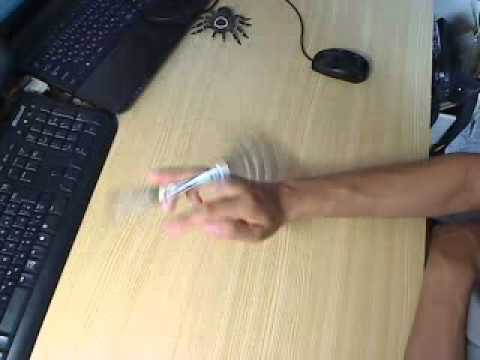
In order to click on computer mouse cord in this screenshot , I will do `click(301, 30)`.